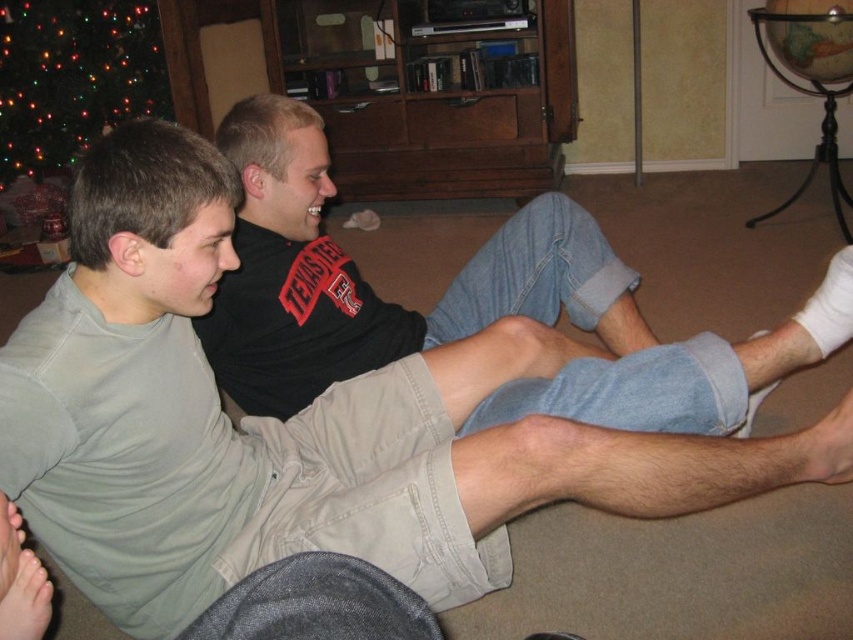
Does light gray cotton pants at center lie behind green glittering lights at upper left?

That is False.

Between light gray cotton pants at center and green glittering lights at upper left, which one has more height?

green glittering lights at upper left is taller.

I want to click on light gray cotton pants at center, so click(x=454, y=305).